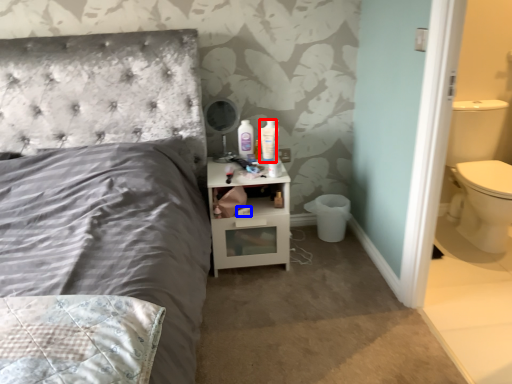
Question: Among these objects, which one is nearest to the camera, mouthwash (highlighted by a red box) or toilet paper (highlighted by a blue box)?

Choices:
 (A) mouthwash
 (B) toilet paper

Answer: (B)